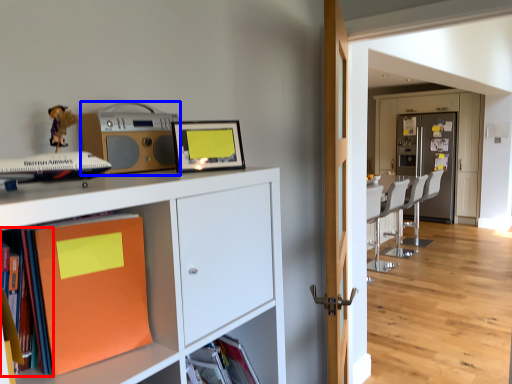
Question: Which of the following is the closest to the observer, book (highlighted by a red box) or stereo (highlighted by a blue box)?

Choices:
 (A) book
 (B) stereo

Answer: (A)